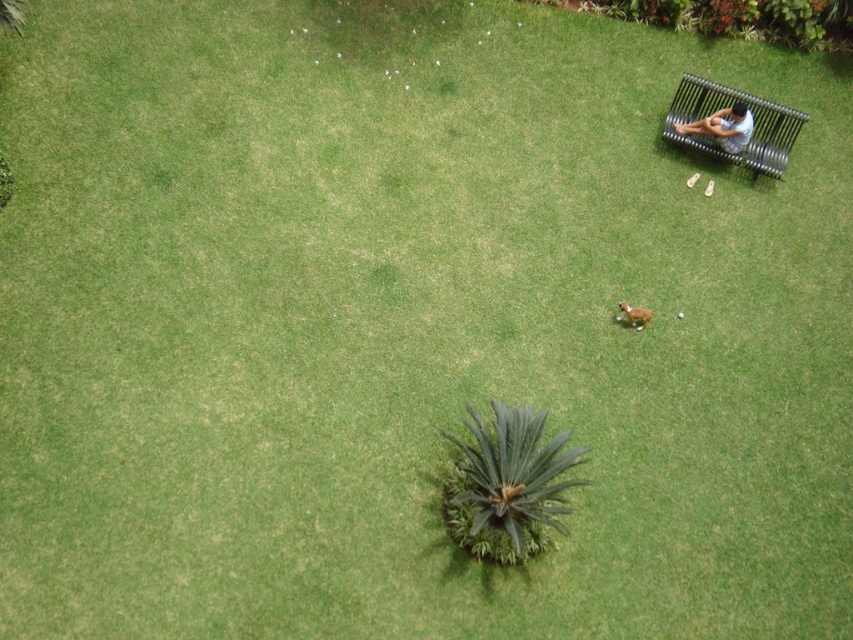
You are planning to place a new bench in the park. You see the metallic silver park bench at upper right and the light blue fabric bench at upper right. Which bench is covering the other one?

The metallic silver park bench at upper right is positioned over the light blue fabric bench at upper right, so it is covering it.

You are planning to place a small potted plant between the metallic silver park bench at upper right and the brown furry dog at center. Considering their sizes, which object should the plant be closer to?

The metallic silver park bench at upper right is wider than the brown furry dog at center, so the plant should be placed closer to the brown furry dog at center to maintain balance between their sizes.